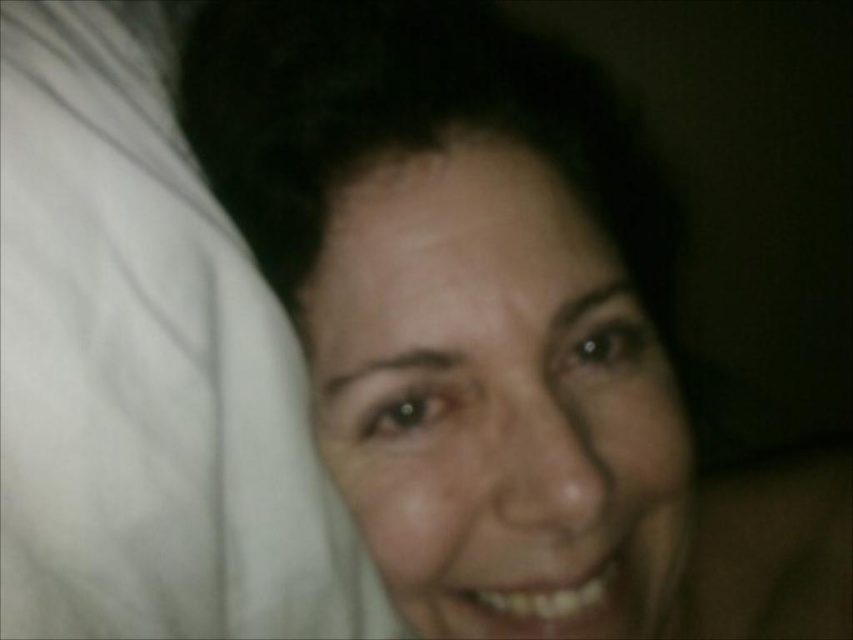
Question: Does white soft fabric at left come behind smooth skin face at center?

Choices:
 (A) yes
 (B) no

Answer: (A)

Question: Is white soft fabric at left below smooth skin face at center?

Choices:
 (A) yes
 (B) no

Answer: (B)

Question: Which of the following is the farthest from the observer?

Choices:
 (A) white soft fabric at left
 (B) smooth skin face at center

Answer: (A)

Question: Among these points, which one is farthest from the camera?

Choices:
 (A) (213, 380)
 (B) (640, 499)

Answer: (A)

Question: From the image, what is the correct spatial relationship of white soft fabric at left in relation to smooth skin face at center?

Choices:
 (A) right
 (B) left

Answer: (B)